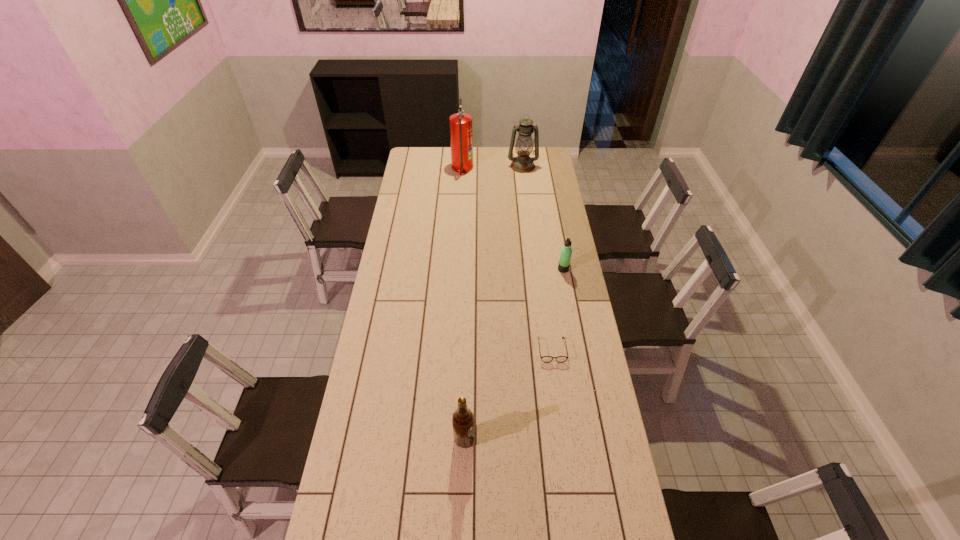
This screenshot has width=960, height=540. In order to click on free space at the left edge in this screenshot , I will do (368, 398).

I want to click on vacant space at the right edge of the desktop, so click(592, 531).

Identify the location of vacant point located between the fire extinguisher and the shortest object. The width and height of the screenshot is (960, 540). (507, 259).

This screenshot has width=960, height=540. What are the coordinates of `vacant area between the fire extinguisher and the beer bottle` in the screenshot? It's located at (464, 303).

This screenshot has height=540, width=960. Identify the location of vacant region between the nearest object and the tallest object. (464, 303).

This screenshot has height=540, width=960. I want to click on free space that is in between the nearest object and the rightmost object, so click(x=514, y=354).

Where is `free point between the nearest object and the fourth farthest object`? The height and width of the screenshot is (540, 960). free point between the nearest object and the fourth farthest object is located at coordinates (508, 394).

Locate an element on the screen. This screenshot has width=960, height=540. free space that is in between the fire extinguisher and the third tallest object is located at coordinates (464, 303).

This screenshot has width=960, height=540. I want to click on free spot between the second shortest object and the spectacles, so click(x=558, y=309).

Identify the location of vacant space that is in between the tallest object and the shortest object. This screenshot has height=540, width=960. pos(507,259).